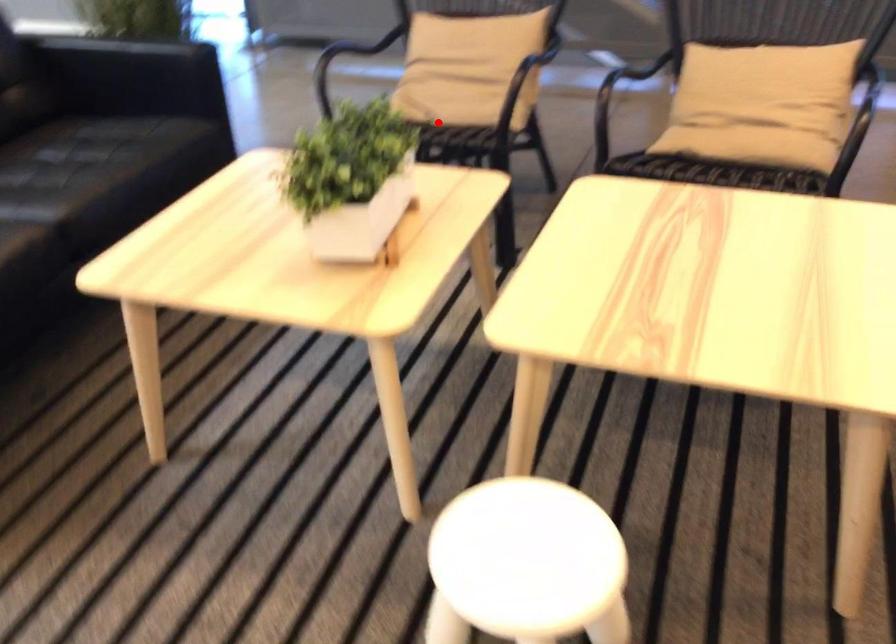
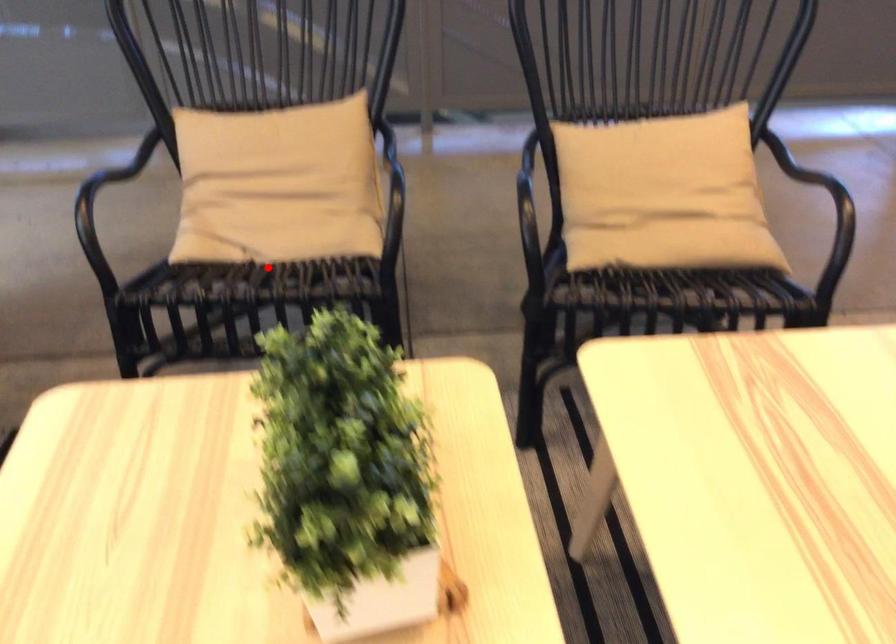
I am providing you with two images of the same scene from different viewpoints. A red point is marked on the first image and another point is marked on the second image. Is the red point in image1 aligned with the point shown in image2?

Yes